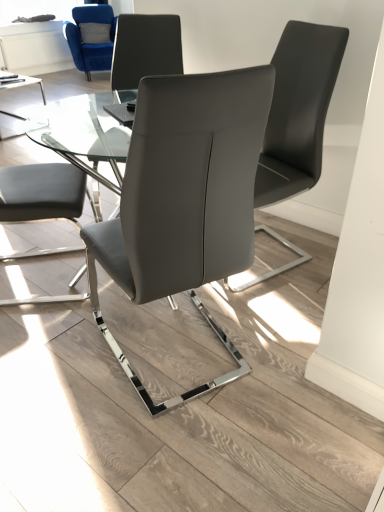
Image resolution: width=384 pixels, height=512 pixels. What do you see at coordinates (36, 9) in the screenshot? I see `transparent glass window screen at upper left` at bounding box center [36, 9].

This screenshot has height=512, width=384. What are the coordinates of `matte gray chair at center, the second chair from the left` in the screenshot? It's located at (142, 56).

Describe the element at coordinates (142, 56) in the screenshot. I see `matte gray chair at center, marked as the 2th chair in a back-to-front arrangement` at that location.

What do you see at coordinates (298, 110) in the screenshot? I see `matte gray chair at center, placed as the 3th chair when sorted from back to front` at bounding box center [298, 110].

Locate an element on the screen. transparent glass table at center is located at coordinates (83, 133).

Locate an element on the screen. The height and width of the screenshot is (512, 384). transparent glass window screen at upper left is located at coordinates (36, 9).

Where is `the 2nd chair to the right of the matte gray chair at center, marked as the 2th chair in a back-to-front arrangement, counting from the anchor's position`? the 2nd chair to the right of the matte gray chair at center, marked as the 2th chair in a back-to-front arrangement, counting from the anchor's position is located at coordinates (298, 110).

From a real-world perspective, who is located higher, matte gray chair at center, the first chair when ordered from right to left, or matte gray chair at center, the second chair from the left?

From a 3D spatial view, matte gray chair at center, the second chair from the left, is above.

Can you confirm if matte gray chair at center, arranged as the 4th chair when viewed from the left, is taller than matte gray chair at center, which is counted as the 3th chair, starting from the front?

Indeed, matte gray chair at center, arranged as the 4th chair when viewed from the left, has a greater height compared to matte gray chair at center, which is counted as the 3th chair, starting from the front.

From a real-world perspective, which is physically below, matte gray chair at center, the second chair when ordered from front to back, or transparent glass table at center?

transparent glass table at center, from a real-world perspective.

Could transparent glass table at center be considered to be inside matte gray chair at center, the second chair when ordered from front to back?

No, transparent glass table at center is not inside matte gray chair at center, the second chair when ordered from front to back.

Is matte gray chair at center, the 2th chair in the bottom-to-top sequence, to the right of transparent glass table at center from the viewer's perspective?

Indeed, matte gray chair at center, the 2th chair in the bottom-to-top sequence, is positioned on the right side of transparent glass table at center.

You are a GUI agent. You are given a task and a screenshot of the screen. Output one action in this format:
    pyautogui.click(x=<x>, y=<y>)
    Task: Click on the 3rd chair located above the transparent glass table at center (from a real-world perspective)
    
    Given the screenshot: What is the action you would take?
    pyautogui.click(x=298, y=110)

How distant is matte gray chair at center, which is the third chair from right to left, from transparent glass window screen at upper left?

matte gray chair at center, which is the third chair from right to left, is 7.86 feet away from transparent glass window screen at upper left.

Would you say matte gray chair at center, which is counted as the 3th chair, starting from the front, is inside or outside transparent glass window screen at upper left?

The correct answer is: outside.

From a real-world perspective, relative to transparent glass window screen at upper left, is matte gray chair at center, positioned as the 3th chair in bottom-to-top order, vertically above or below?

matte gray chair at center, positioned as the 3th chair in bottom-to-top order, is situated lower than transparent glass window screen at upper left in the real world.

Which of these two, matte gray chair at center, marked as the 2th chair in a back-to-front arrangement, or transparent glass window screen at upper left, stands shorter?

With less height is transparent glass window screen at upper left.

From a real-world perspective, which object stands above the other?

matte gray chair at center, the second chair when ordered from front to back, is physically above.

Find the location of a particular element. chair below the matte gray chair at center, acting as the 3th chair starting from the top (from the image's perspective) is located at coordinates (185, 198).

Is matte gray chair at center, the third chair from the left, wider or thinner than matte gray chair at center, arranged as the 4th chair when viewed from the left?

In the image, matte gray chair at center, the third chair from the left, appears to be wider than matte gray chair at center, arranged as the 4th chair when viewed from the left.

From a real-world perspective, which object stands above the other?

transparent glass window screen at upper left is physically above.

From the image's perspective, which is above, transparent glass window screen at upper left or matte gray chair at center, positioned as the 3th chair in bottom-to-top order?

transparent glass window screen at upper left is shown above in the image.

Which of these two, transparent glass window screen at upper left or matte gray chair at center, which is counted as the 3th chair, starting from the front, is bigger?

matte gray chair at center, which is counted as the 3th chair, starting from the front, is bigger.

Between point (14, 11) and point (132, 15), which one is positioned behind?

The point (14, 11) is behind.

Is matte gray chair at center, the third chair from the left, shorter than transparent glass window screen at upper left?

No.

From the picture: Considering the sizes of matte gray chair at center, arranged as the 2th chair when viewed from the right, and transparent glass window screen at upper left in the image, is matte gray chair at center, arranged as the 2th chair when viewed from the right, bigger or smaller than transparent glass window screen at upper left?

Clearly, matte gray chair at center, arranged as the 2th chair when viewed from the right, is larger in size than transparent glass window screen at upper left.

Who is more distant, matte gray chair at center, arranged as the first chair when viewed from the front, or transparent glass window screen at upper left?

transparent glass window screen at upper left is further from the camera.

How far apart are matte gray chair at center, the fourth chair from the top, and transparent glass window screen at upper left?

4.45 meters.

Does point (66, 35) come behind point (182, 269)?

That is True.

Which of these two, velvet blue armchair at upper left, the 4th chair viewed from the right, or matte gray chair at center, the third chair from the left, stands shorter?

Standing shorter between the two is velvet blue armchair at upper left, the 4th chair viewed from the right.

Is the position of velvet blue armchair at upper left, which appears as the first chair when viewed from the back, less distant than that of matte gray chair at center, the 4th chair when ordered from back to front?

No, velvet blue armchair at upper left, which appears as the first chair when viewed from the back, is further to the viewer.

Identify the location of chair that is the 3rd object located behind the matte gray chair at center, the 4th chair when ordered from back to front. (91, 37).

Which chair is the 1st one when counting from the front of the matte gray chair at center, which is the third chair from right to left? Please provide its 2D coordinates.

[(298, 110)]

From the image's perspective, which chair is the 1st one above the transparent glass table at center? Please provide its 2D coordinates.

[(298, 110)]

From the picture: Based on their spatial positions, is matte gray chair at center, marked as the 2th chair in a back-to-front arrangement, or transparent glass table at center further from velvet blue armchair at upper left, the 4th chair viewed from the right?

The object further to velvet blue armchair at upper left, the 4th chair viewed from the right, is matte gray chair at center, marked as the 2th chair in a back-to-front arrangement.

When comparing their distances from transparent glass window screen at upper left, does matte gray chair at center, the second chair when ordered from front to back, or transparent glass table at center seem further?

Based on the image, matte gray chair at center, the second chair when ordered from front to back, appears to be further to transparent glass window screen at upper left.

Estimate the real-world distances between objects in this image. Which object is further from transparent glass table at center, matte gray chair at center, placed as the 3th chair when sorted from back to front, or velvet blue armchair at upper left, marked as the fourth chair in a bottom-to-top arrangement?

matte gray chair at center, placed as the 3th chair when sorted from back to front, is further to transparent glass table at center.

Which object lies further to the anchor point transparent glass table at center, velvet blue armchair at upper left, which appears as the 1th chair when viewed from the top, or transparent glass window screen at upper left?

transparent glass window screen at upper left is positioned further to the anchor transparent glass table at center.

Estimate the real-world distances between objects in this image. Which object is closer to matte gray chair at center, the second chair from the top, transparent glass table at center or transparent glass window screen at upper left?

The object closer to matte gray chair at center, the second chair from the top, is transparent glass table at center.

Looking at the image, which one is located closer to velvet blue armchair at upper left, marked as the fourth chair in a bottom-to-top arrangement, transparent glass table at center or matte gray chair at center, which is the third chair from right to left?

transparent glass table at center is closer to velvet blue armchair at upper left, marked as the fourth chair in a bottom-to-top arrangement.

Looking at the image, which one is located closer to transparent glass window screen at upper left, velvet blue armchair at upper left, which appears as the 1th chair when viewed from the top, or transparent glass table at center?

velvet blue armchair at upper left, which appears as the 1th chair when viewed from the top, lies closer to transparent glass window screen at upper left than the other object.

When comparing their distances from matte gray chair at center, placed as the first chair when sorted from bottom to top, does transparent glass window screen at upper left or matte gray chair at center, acting as the 3th chair starting from the top, seem closer?

matte gray chair at center, acting as the 3th chair starting from the top, lies closer to matte gray chair at center, placed as the first chair when sorted from bottom to top, than the other object.

Locate an element on the screen. This screenshot has width=384, height=512. chair between matte gray chair at center, the second chair from the left, and transparent glass table at center, in the vertical direction is located at coordinates (298, 110).

In order to click on round table positioned between matte gray chair at center, arranged as the 2th chair when viewed from the right, and matte gray chair at center, the second chair from the left, from near to far in this screenshot , I will do `click(83, 133)`.

This screenshot has height=512, width=384. Identify the location of round table between matte gray chair at center, arranged as the 2th chair when viewed from the right, and matte gray chair at center, the second chair when ordered from front to back, along the z-axis. (83, 133).

Where is `chair between matte gray chair at center, marked as the 2th chair in a back-to-front arrangement, and transparent glass window screen at upper left, along the z-axis`? Image resolution: width=384 pixels, height=512 pixels. chair between matte gray chair at center, marked as the 2th chair in a back-to-front arrangement, and transparent glass window screen at upper left, along the z-axis is located at coordinates (91, 37).